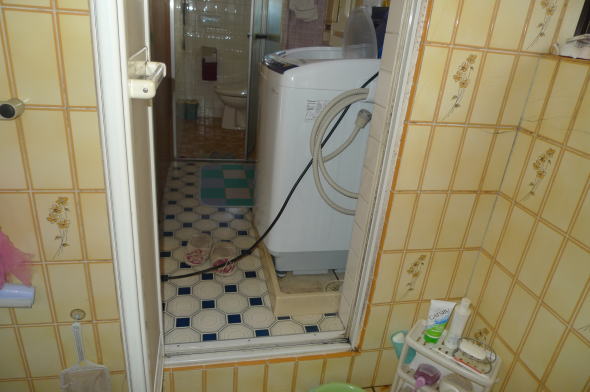
This screenshot has height=392, width=590. What are the coordinates of `handle` in the screenshot? It's located at (81, 333).